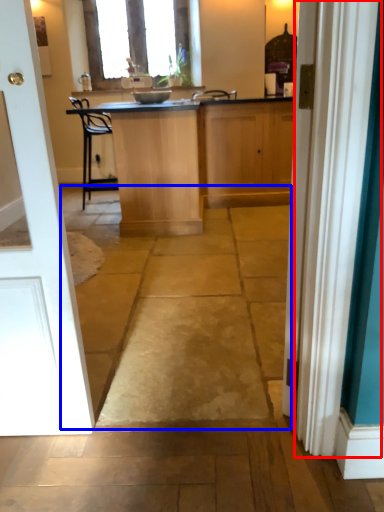
Question: Which of the following is the closest to the observer, curtain (highlighted by a red box) or path (highlighted by a blue box)?

Choices:
 (A) curtain
 (B) path

Answer: (A)